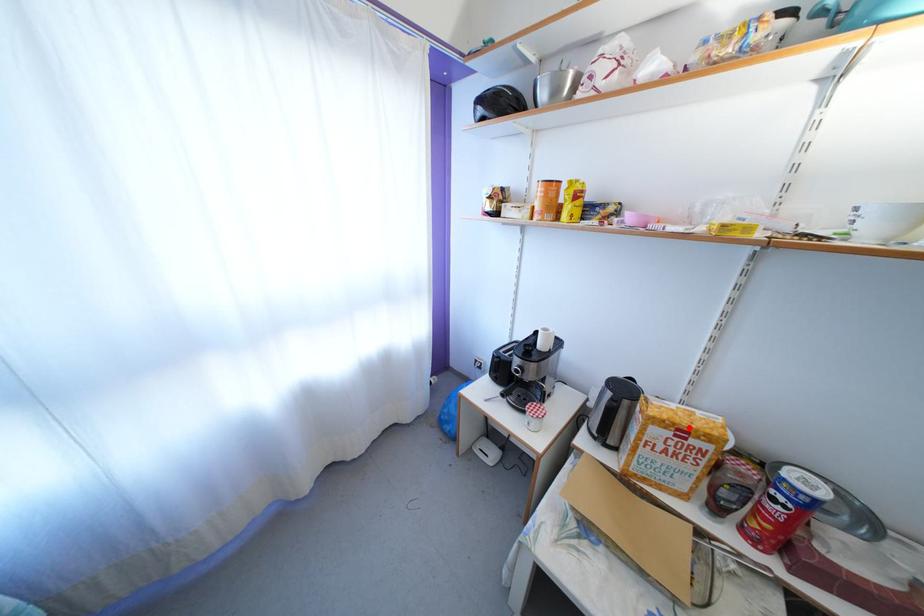
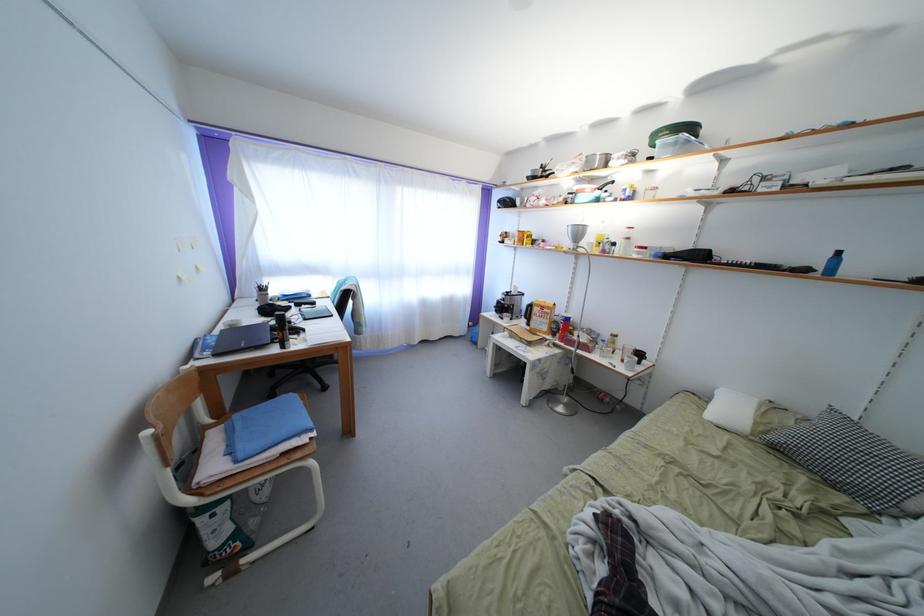
In the second image, find the point that corresponds to the highlighted location in the first image.

(549, 310)